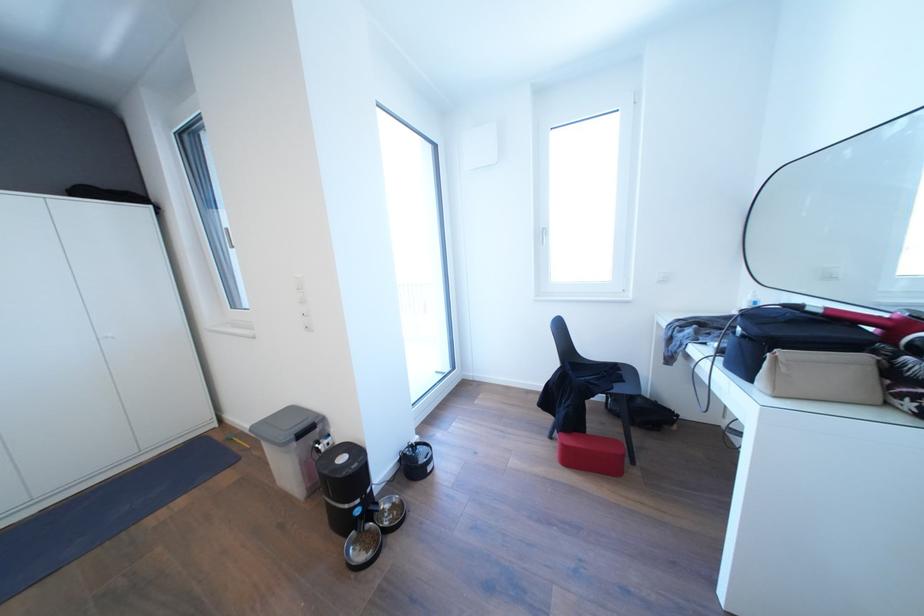
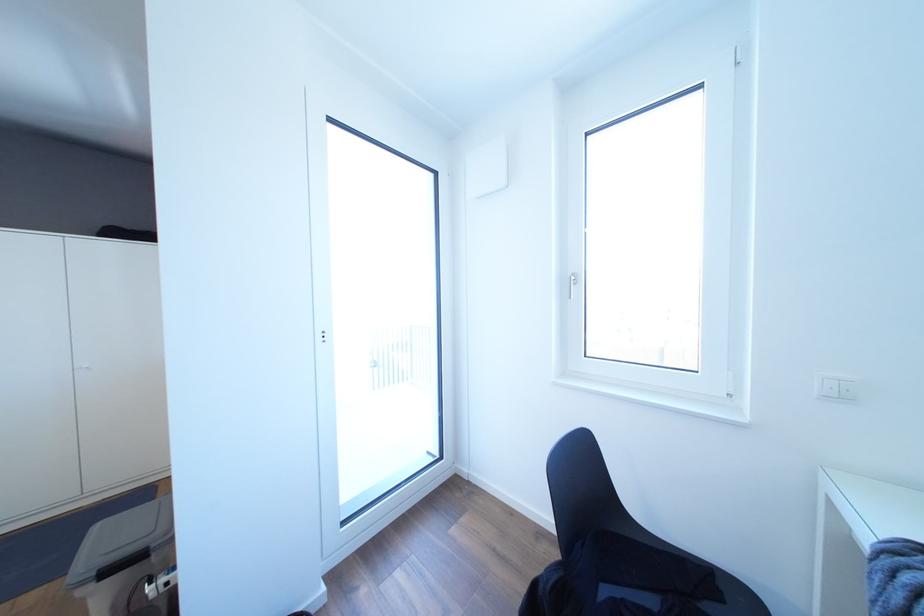
The images are taken continuously from a first-person perspective. In which direction are you moving?

The cameraman walked toward right, forward.